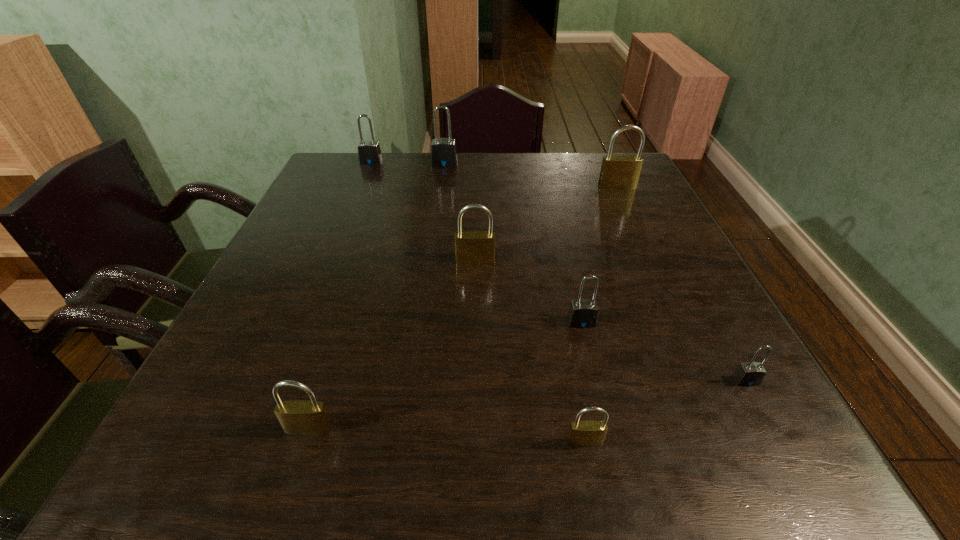
Find the location of a particular element. free space located on the shackle of the third gray padlock from left to right is located at coordinates (608, 435).

This screenshot has height=540, width=960. I want to click on free space located on the shackle of the rightmost gray padlock, so click(x=773, y=430).

In order to click on object positioned at the left edge in this screenshot , I will do `click(369, 153)`.

Identify the location of object present at the far left corner. The width and height of the screenshot is (960, 540). [369, 153].

What are the coordinates of `object that is at the far right corner` in the screenshot? It's located at (618, 172).

The image size is (960, 540). In the image, there is a desktop. Find the location of `vacant space at the far edge`. vacant space at the far edge is located at coordinates (476, 188).

In order to click on vacant space at the near edge of the desktop in this screenshot , I will do `click(421, 470)`.

In order to click on vacant space at the left edge of the desktop in this screenshot , I will do `click(324, 226)`.

At what (x,y) coordinates should I click in order to perform the action: click on free space at the right edge of the desktop. Please return your answer as a coordinate pair (x, y). Image resolution: width=960 pixels, height=540 pixels. Looking at the image, I should click on (736, 351).

Where is `free space at the near right corner of the desktop`? free space at the near right corner of the desktop is located at coordinates (807, 477).